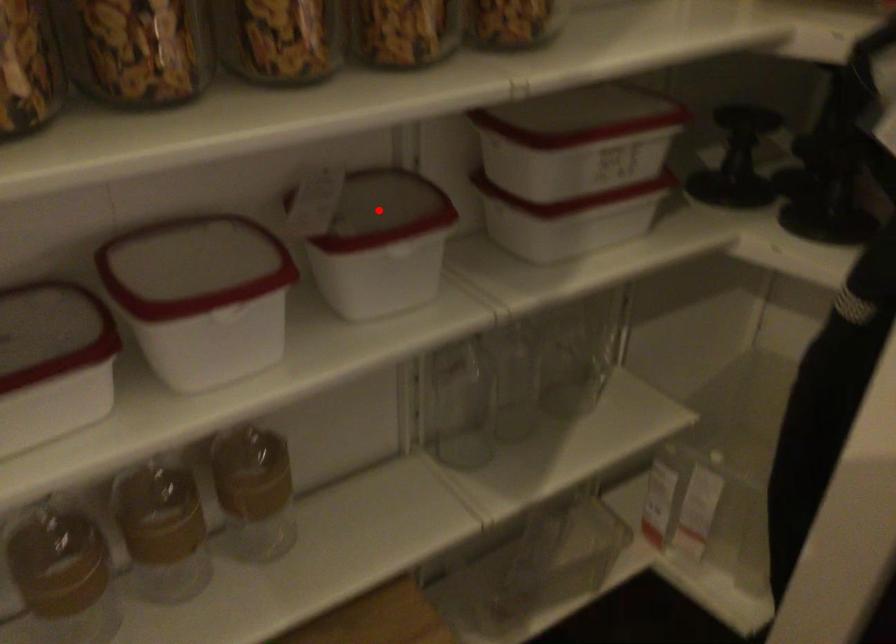
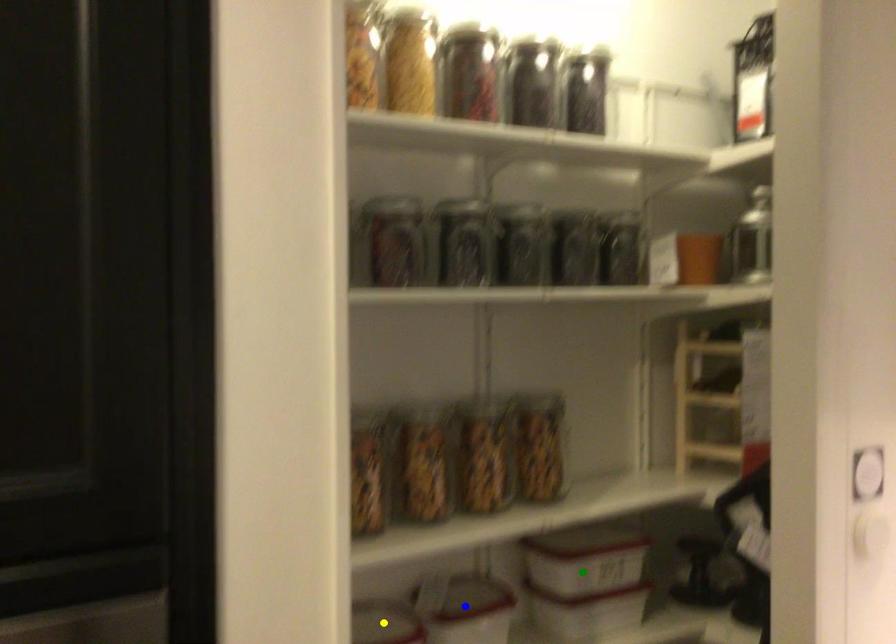
Question: I am providing you with two images of the same scene from different viewpoints. A red point is marked on the first image. You are given multiple points on the second image. Which point in image 2 is actually the same real-world point as the red point in image 1?

Choices:
 (A) blue point
 (B) green point
 (C) yellow point

Answer: (A)